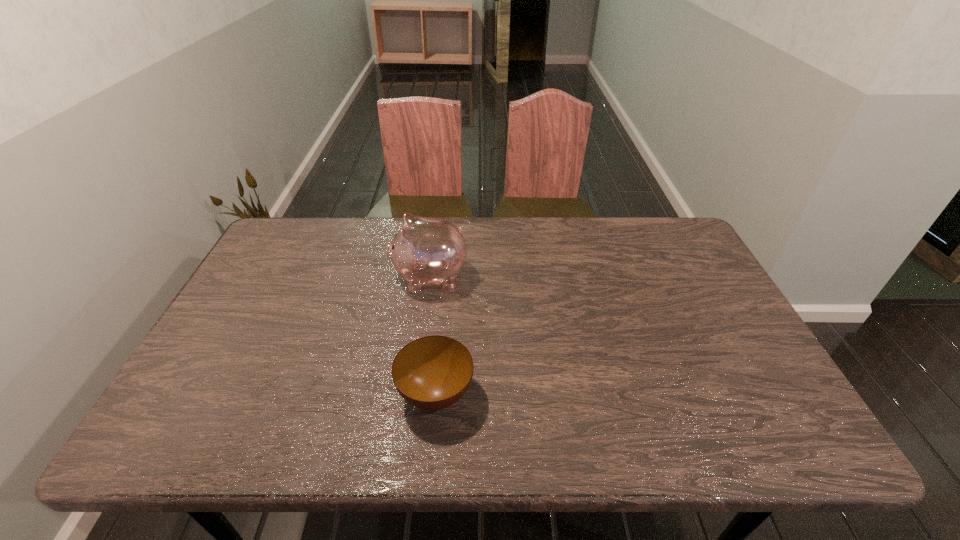
Where is `free space that satisfies the following two spatial constraints: 1. on the front facing side of the nearer object; 2. on the left side of the piggy bank`? free space that satisfies the following two spatial constraints: 1. on the front facing side of the nearer object; 2. on the left side of the piggy bank is located at coordinates (415, 394).

Find the location of a particular element. The height and width of the screenshot is (540, 960). free space that satisfies the following two spatial constraints: 1. on the front facing side of the shorter object; 2. on the right side of the piggy bank is located at coordinates (415, 394).

Where is `free spot that satisfies the following two spatial constraints: 1. on the front facing side of the farther object; 2. on the left side of the shorter object`? Image resolution: width=960 pixels, height=540 pixels. free spot that satisfies the following two spatial constraints: 1. on the front facing side of the farther object; 2. on the left side of the shorter object is located at coordinates (415, 394).

In order to click on vacant region that satisfies the following two spatial constraints: 1. on the front facing side of the farther object; 2. on the right side of the bowl in this screenshot , I will do [x=415, y=394].

Image resolution: width=960 pixels, height=540 pixels. Find the location of `vacant region that satisfies the following two spatial constraints: 1. on the front facing side of the shorter object; 2. on the left side of the taller object`. vacant region that satisfies the following two spatial constraints: 1. on the front facing side of the shorter object; 2. on the left side of the taller object is located at coordinates point(415,394).

Identify the location of vacant space that satisfies the following two spatial constraints: 1. on the front facing side of the piggy bank; 2. on the left side of the nearer object. (415, 394).

Where is `free space that satisfies the following two spatial constraints: 1. on the front facing side of the taller object; 2. on the left side of the shorter object`? free space that satisfies the following two spatial constraints: 1. on the front facing side of the taller object; 2. on the left side of the shorter object is located at coordinates (415, 394).

You are a GUI agent. You are given a task and a screenshot of the screen. Output one action in this format:
    pyautogui.click(x=<x>, y=<y>)
    Task: Click on the free space that satisfies the following two spatial constraints: 1. on the back side of the shorter object; 2. on the front facing side of the taller object
    This screenshot has height=540, width=960.
    Given the screenshot: What is the action you would take?
    pyautogui.click(x=446, y=278)

Locate an element on the screen. vacant region that satisfies the following two spatial constraints: 1. on the front facing side of the shorter object; 2. on the right side of the taller object is located at coordinates (415, 394).